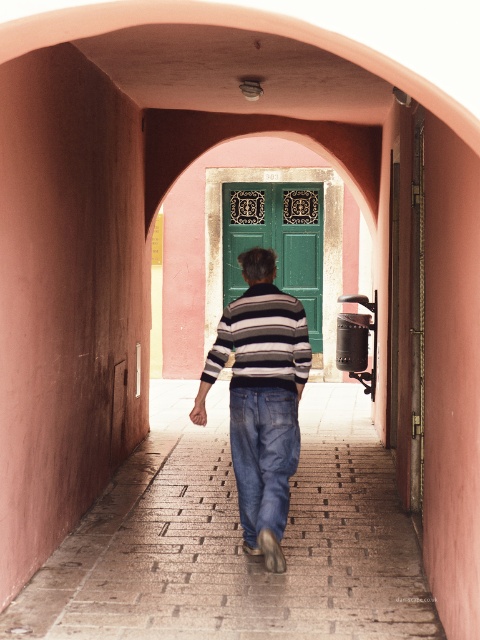
You are standing in the passageway and want to know if the green painted wood door at center can fit the striped cotton shirt at center through it without needing to fold it. Can it?

The green painted wood door at center is wider than the striped cotton shirt at center, so the shirt can pass through the door without folding.